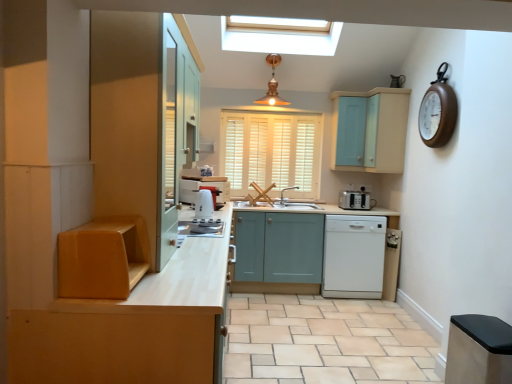
Question: From the image's perspective, is light blue wood cabinet at upper right, placed as the 1th cabinetry when sorted from right to left, on white glossy dishwasher at lower center?

Choices:
 (A) yes
 (B) no

Answer: (A)

Question: From the image's perspective, is light blue wood cabinet at upper right, the 5th cabinetry positioned from the left, below white glossy dishwasher at lower center?

Choices:
 (A) no
 (B) yes

Answer: (A)

Question: Is light blue wood cabinet at upper right, the 5th cabinetry positioned from the left, placed right next to white glossy dishwasher at lower center?

Choices:
 (A) yes
 (B) no

Answer: (B)

Question: Is light blue wood cabinet at upper right, the 5th cabinetry positioned from the left, bigger than white glossy dishwasher at lower center?

Choices:
 (A) no
 (B) yes

Answer: (A)

Question: Is light blue wood cabinet at upper right, placed as the 1th cabinetry when sorted from right to left, closer to camera compared to white glossy dishwasher at lower center?

Choices:
 (A) no
 (B) yes

Answer: (B)

Question: Are light blue wood cabinet at upper right, the 5th cabinetry positioned from the left, and white glossy dishwasher at lower center far apart?

Choices:
 (A) yes
 (B) no

Answer: (B)

Question: Is matte yellow cabinet at left, placed as the 5th cabinetry when sorted from right to left, aimed at matte wood cabinet at left, marked as the fourth cabinetry in a right-to-left arrangement?

Choices:
 (A) no
 (B) yes

Answer: (A)

Question: From a real-world perspective, is matte yellow cabinet at left, placed as the 5th cabinetry when sorted from right to left, on matte wood cabinet at left, marked as the fourth cabinetry in a right-to-left arrangement?

Choices:
 (A) yes
 (B) no

Answer: (A)

Question: Is matte yellow cabinet at left, the first cabinetry viewed from the left, bigger than matte wood cabinet at left, marked as the fourth cabinetry in a right-to-left arrangement?

Choices:
 (A) no
 (B) yes

Answer: (A)

Question: Can you confirm if matte yellow cabinet at left, placed as the 5th cabinetry when sorted from right to left, is wider than matte wood cabinet at left, placed as the second cabinetry when sorted from left to right?

Choices:
 (A) no
 (B) yes

Answer: (A)

Question: Considering the relative positions of matte yellow cabinet at left, placed as the 5th cabinetry when sorted from right to left, and matte wood cabinet at left, placed as the second cabinetry when sorted from left to right, in the image provided, is matte yellow cabinet at left, placed as the 5th cabinetry when sorted from right to left, to the left of matte wood cabinet at left, placed as the second cabinetry when sorted from left to right, from the viewer's perspective?

Choices:
 (A) yes
 (B) no

Answer: (A)

Question: From the image's perspective, is matte yellow cabinet at left, placed as the 5th cabinetry when sorted from right to left, on top of matte wood cabinet at left, placed as the second cabinetry when sorted from left to right?

Choices:
 (A) no
 (B) yes

Answer: (B)

Question: Can you confirm if copper/textured pendant light at upper center is thinner than stainless steel trash can at lower right, which ranks as the second cabinetry in right-to-left order?

Choices:
 (A) no
 (B) yes

Answer: (A)